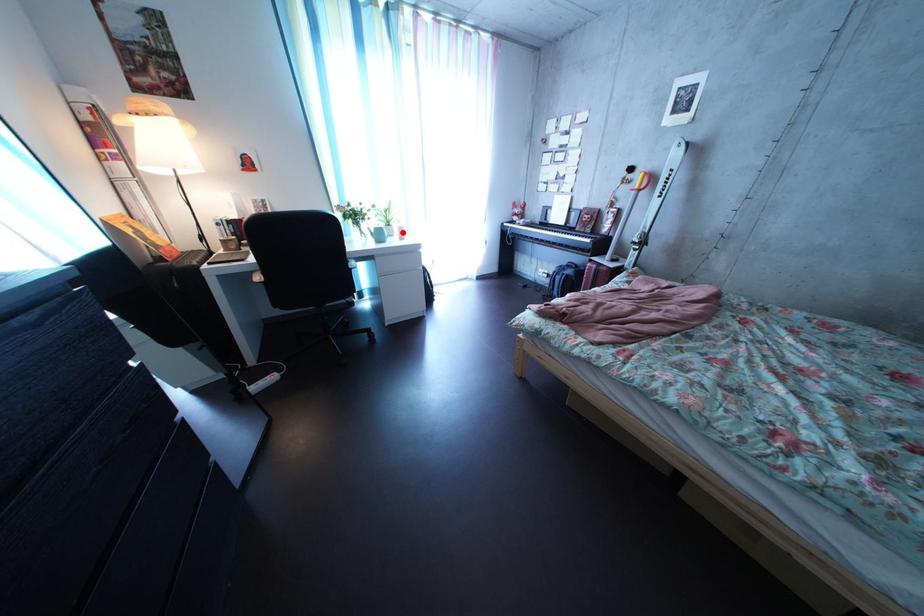
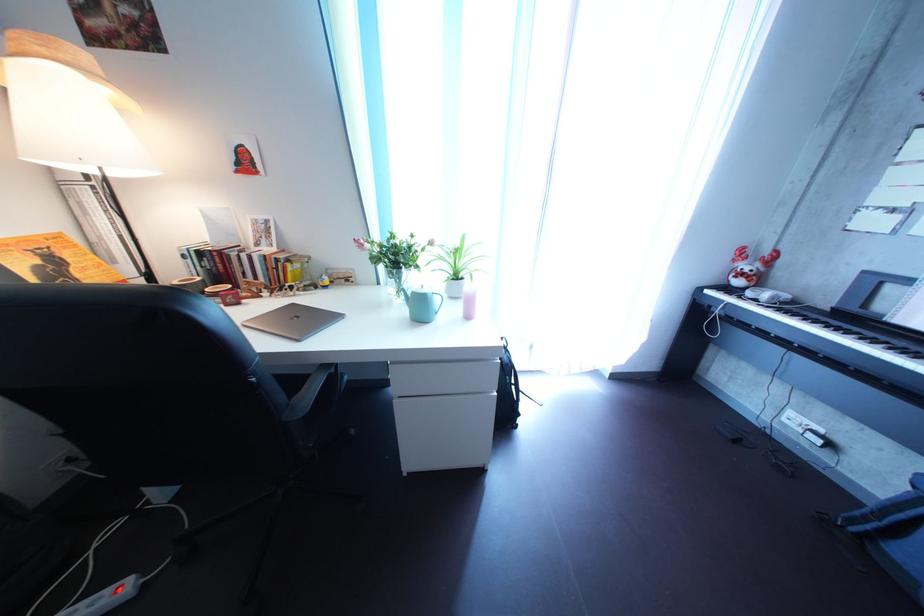
Question: I am providing you with two images of the same scene from different viewpoints. Image1 has a red point marked. In image2, the corresponding 3D location appears at what relative position? Reply with the corresponding letter.

Choices:
 (A) Closer
 (B) Farther

Answer: (B)